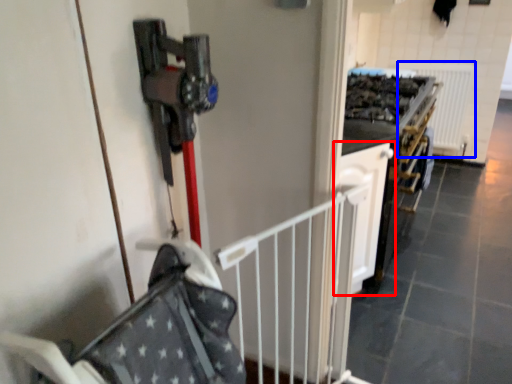
Question: Which object appears closest to the camera in this image, cabinetry (highlighted by a red box) or radiator (highlighted by a blue box)?

Choices:
 (A) cabinetry
 (B) radiator

Answer: (A)